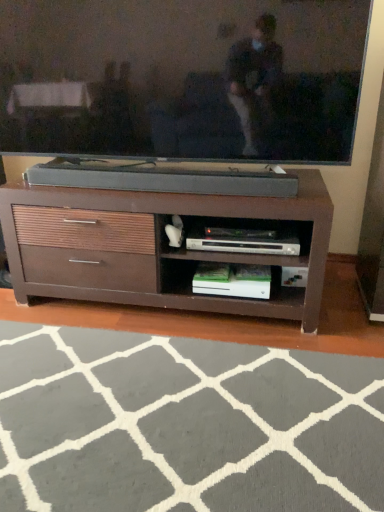
The height and width of the screenshot is (512, 384). Identify the location of free spot in front of brown wood chest of drawers at center. (178, 384).